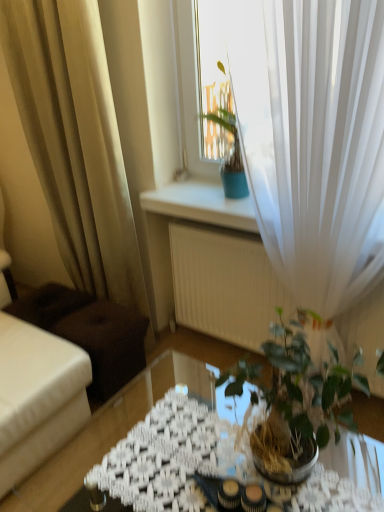
Question: Is white sheer curtain at upper right, which is the 2th curtain from left to right, oriented away from translucent glass table at center?

Choices:
 (A) yes
 (B) no

Answer: (B)

Question: Is white sheer curtain at upper right, which is the 2th curtain from left to right, positioned beyond the bounds of translucent glass table at center?

Choices:
 (A) no
 (B) yes

Answer: (B)

Question: From a real-world perspective, does white sheer curtain at upper right, the 1th curtain positioned from the right, stand above translucent glass table at center?

Choices:
 (A) yes
 (B) no

Answer: (A)

Question: Is white sheer curtain at upper right, the 1th curtain positioned from the right, closer to the viewer compared to translucent glass table at center?

Choices:
 (A) no
 (B) yes

Answer: (A)

Question: Does white sheer curtain at upper right, which is the 2th curtain from left to right, come behind translucent glass table at center?

Choices:
 (A) no
 (B) yes

Answer: (B)

Question: Can you confirm if white sheer curtain at upper right, the 1th curtain positioned from the right, is thinner than translucent glass table at center?

Choices:
 (A) yes
 (B) no

Answer: (A)

Question: Considering the relative positions of green glossy houseplant at center and white sheer curtain at upper right, the 1th curtain positioned from the right, in the image provided, is green glossy houseplant at center to the left of white sheer curtain at upper right, the 1th curtain positioned from the right, from the viewer's perspective?

Choices:
 (A) no
 (B) yes

Answer: (B)

Question: Considering the relative positions of green glossy houseplant at center and white sheer curtain at upper right, which is the 2th curtain from left to right, in the image provided, is green glossy houseplant at center behind white sheer curtain at upper right, which is the 2th curtain from left to right,?

Choices:
 (A) yes
 (B) no

Answer: (B)

Question: From the image's perspective, is green glossy houseplant at center above white sheer curtain at upper right, which is the 2th curtain from left to right?

Choices:
 (A) yes
 (B) no

Answer: (B)

Question: Would you say white sheer curtain at upper right, which is the 2th curtain from left to right, is part of green glossy houseplant at center's contents?

Choices:
 (A) yes
 (B) no

Answer: (B)

Question: From a real-world perspective, is green glossy houseplant at center below white sheer curtain at upper right, the 1th curtain positioned from the right?

Choices:
 (A) yes
 (B) no

Answer: (A)

Question: Can you confirm if green glossy houseplant at center is taller than white sheer curtain at upper right, which is the 2th curtain from left to right?

Choices:
 (A) yes
 (B) no

Answer: (B)

Question: Does translucent glass table at center have a smaller size compared to white sheer curtain at upper right, the 1th curtain positioned from the right?

Choices:
 (A) yes
 (B) no

Answer: (A)